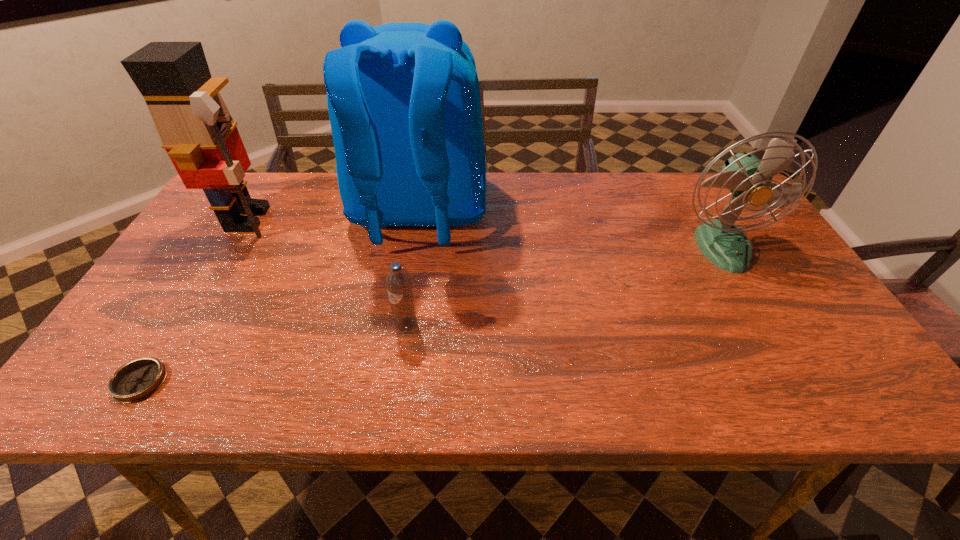
Where is `free space between the backpack and the fourth farthest object`? free space between the backpack and the fourth farthest object is located at coordinates (413, 269).

Image resolution: width=960 pixels, height=540 pixels. Find the location of `vacant point located between the fan and the backpack`. vacant point located between the fan and the backpack is located at coordinates click(x=570, y=230).

Where is `empty space between the nutcracker and the rightmost object`? empty space between the nutcracker and the rightmost object is located at coordinates (485, 232).

Where is `empty space between the fourth tallest object and the backpack`? The width and height of the screenshot is (960, 540). empty space between the fourth tallest object and the backpack is located at coordinates (413, 269).

I want to click on unoccupied area between the compass and the third tallest object, so click(431, 314).

At what (x,y) coordinates should I click in order to perform the action: click on object that stands as the closest to the backpack. Please return your answer as a coordinate pair (x, y). This screenshot has height=540, width=960. Looking at the image, I should click on (399, 287).

Identify which object is the fourth closest to the fan. Please provide its 2D coordinates. Your answer should be formatted as a tuple, i.e. [(x, y)], where the tuple contains the x and y coordinates of a point satisfying the conditions above.

[(138, 379)]

Locate an element on the screen. blank area in the image that satisfies the following two spatial constraints: 1. on the back of the water bottle; 2. on the left side of the backpack is located at coordinates (401, 326).

Where is `vacant space that satisfies the following two spatial constraints: 1. on the back side of the nearest object; 2. on the right side of the second shortest object`? vacant space that satisfies the following two spatial constraints: 1. on the back side of the nearest object; 2. on the right side of the second shortest object is located at coordinates (175, 326).

This screenshot has width=960, height=540. In order to click on free region that satisfies the following two spatial constraints: 1. in front of the nutcracker holding the staff; 2. on the right side of the fourth tallest object in this screenshot , I will do pos(183,326).